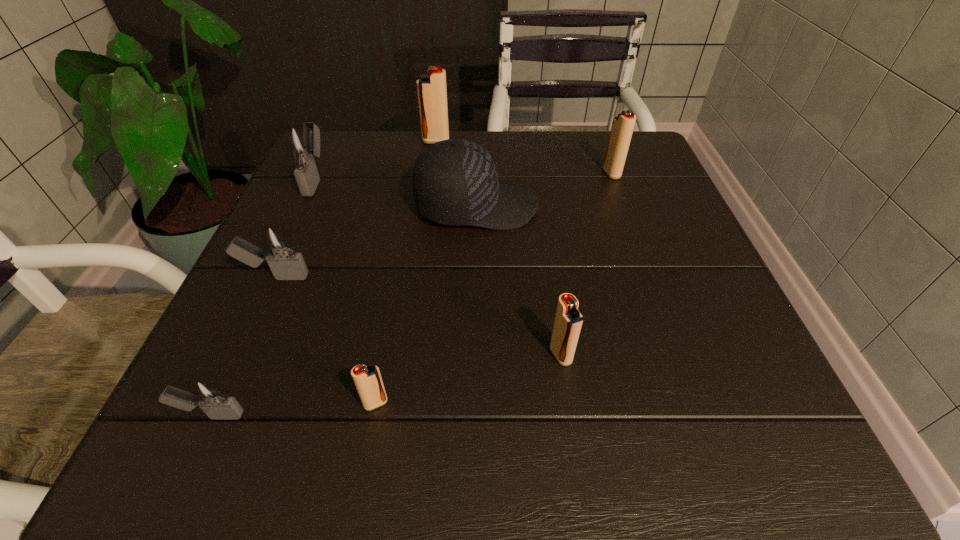
Locate an element on the screen. The width and height of the screenshot is (960, 540). the nearest red igniter is located at coordinates (368, 381).

Locate an element on the screen. The width and height of the screenshot is (960, 540). the nearest gray igniter is located at coordinates (206, 393).

Where is `vacant space located 0.090m on the front of the farthest object`? The image size is (960, 540). vacant space located 0.090m on the front of the farthest object is located at coordinates (433, 165).

This screenshot has height=540, width=960. Find the location of `free space located 0.290m on the left of the rightmost object`. free space located 0.290m on the left of the rightmost object is located at coordinates (475, 173).

This screenshot has height=540, width=960. In order to click on vacant space located on the right of the farthest gray igniter in this screenshot , I will do `click(356, 179)`.

This screenshot has height=540, width=960. I want to click on free space located at the front of the baseball cap where the brim is located, so click(x=644, y=207).

Where is `free space located on the right of the fifth farthest object`? This screenshot has width=960, height=540. free space located on the right of the fifth farthest object is located at coordinates (399, 276).

At what (x,y) coordinates should I click in order to perform the action: click on free space located on the back of the third red igniter from left to right. Please return your answer as a coordinate pair (x, y). Looking at the image, I should click on (541, 226).

At what (x,y) coordinates should I click in order to perform the action: click on vacant region located 0.130m on the back of the smallest red igniter. Please return your answer as a coordinate pair (x, y). The image size is (960, 540). Looking at the image, I should click on (391, 321).

Find the location of a particular element. blank space located on the right of the nearest gray igniter is located at coordinates [503, 415].